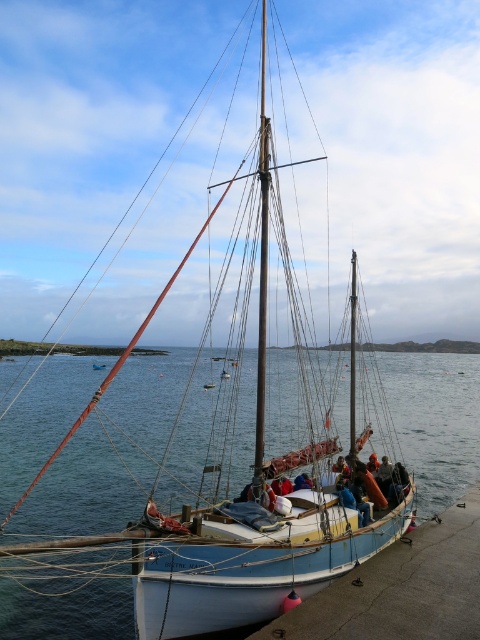
Is blue water at center smaller than polished silver mast at center?

Actually, blue water at center might be larger than polished silver mast at center.

From the picture: Can you confirm if blue water at center is shorter than polished silver mast at center?

Correct, blue water at center is not as tall as polished silver mast at center.

Between point (39, 484) and point (261, 493), which one is positioned in front?

Positioned in front is point (261, 493).

Identify the location of blue water at center. (108, 456).